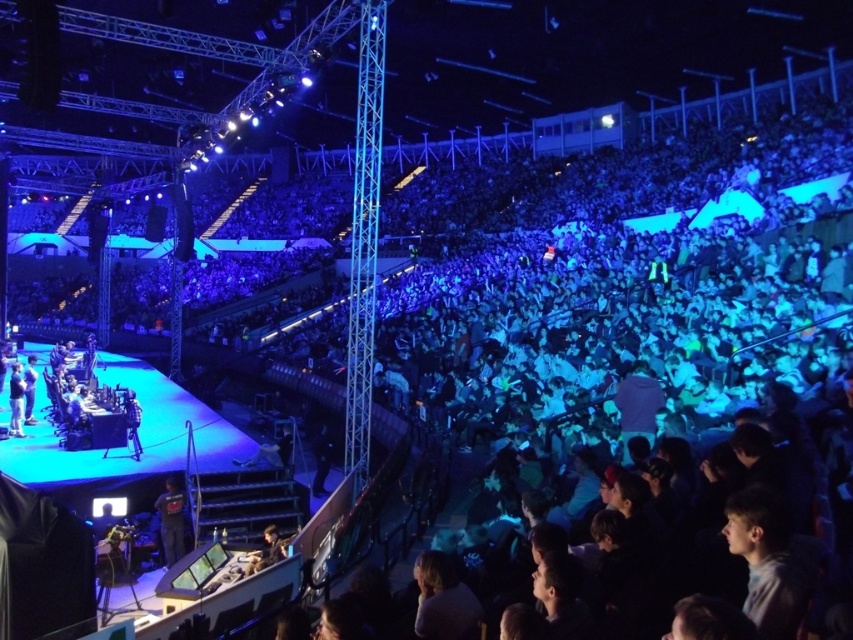
Between dark gray hoodie at center and dark gray fabric jacket at stage left, which one has less height?

With less height is dark gray fabric jacket at stage left.

Does point (167, 484) come in front of point (30, 387)?

Yes.

Identify the location of dark gray hoodie at center. The image size is (853, 640). (171, 520).

Is dark blue fabric jacket at lower center thinner than dark gray fabric jacket at stage left?

Yes.

Between dark blue fabric jacket at lower center and dark gray fabric jacket at stage left, which one is positioned lower?

dark blue fabric jacket at lower center is lower down.

Which is in front, point (270, 536) or point (30, 408)?

Point (270, 536)

What are the coordinates of `dark blue fabric jacket at lower center` in the screenshot? It's located at (265, 552).

Who is shorter, dark gray hoodie at center or dark blue fabric jacket at lower center?

dark blue fabric jacket at lower center is shorter.

Describe the element at coordinates (171, 520) in the screenshot. I see `dark gray hoodie at center` at that location.

At what (x,y) coordinates should I click in order to perform the action: click on dark gray hoodie at center. Please return your answer as a coordinate pair (x, y). Looking at the image, I should click on (171, 520).

Find the location of `dark gray hoodie at center`. dark gray hoodie at center is located at coordinates (171, 520).